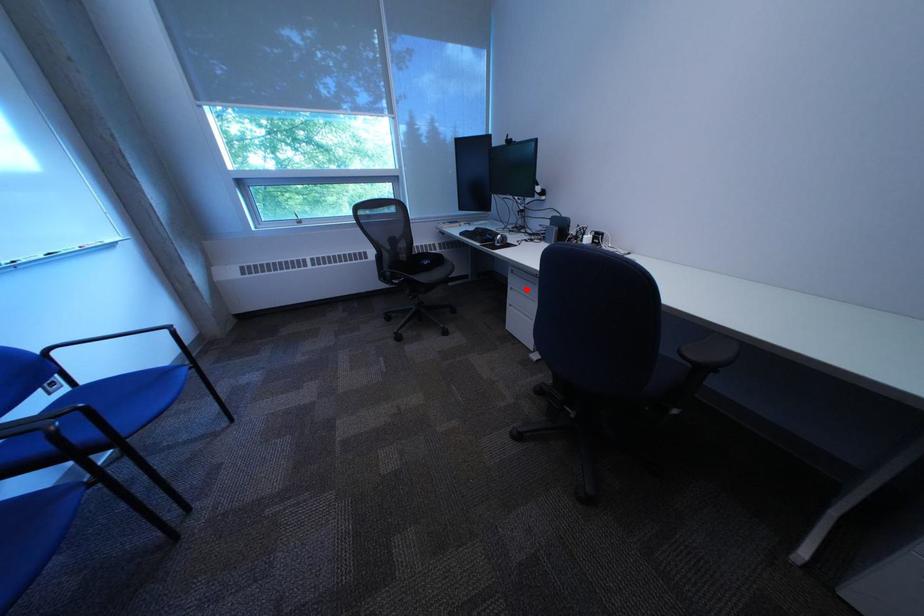
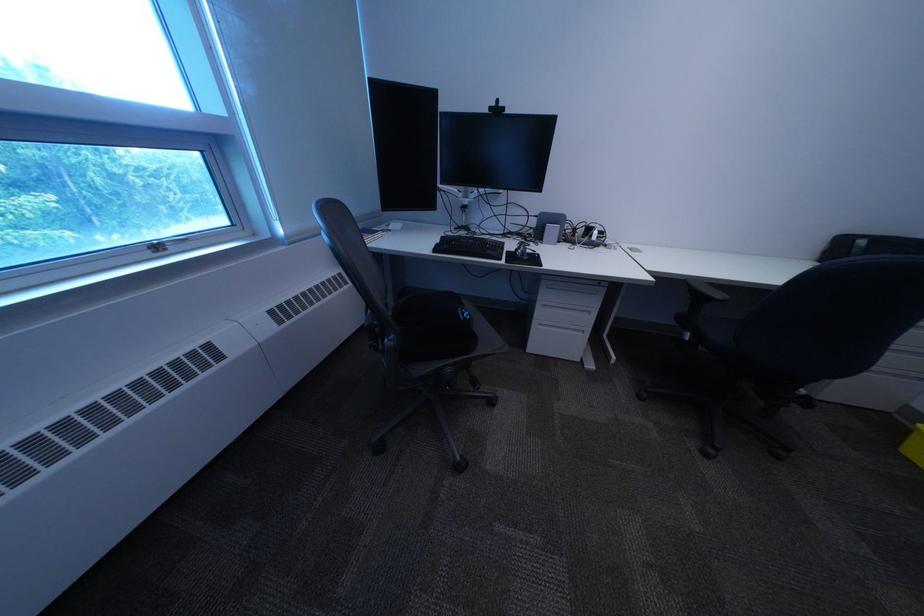
In the second image, find the point that corresponds to the highlighted location in the first image.

(558, 307)